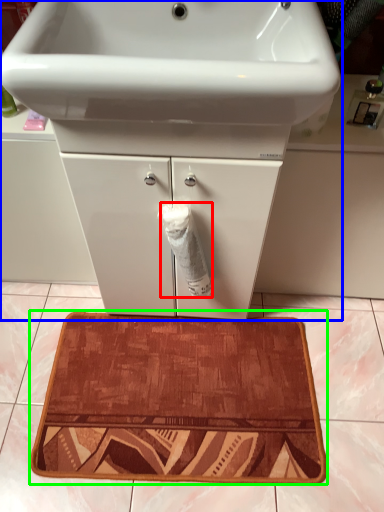
Question: Which is farther away from toilet paper (highlighted by a red box)? bathroom cabinet (highlighted by a blue box) or bath mat (highlighted by a green box)?

Choices:
 (A) bathroom cabinet
 (B) bath mat

Answer: (B)